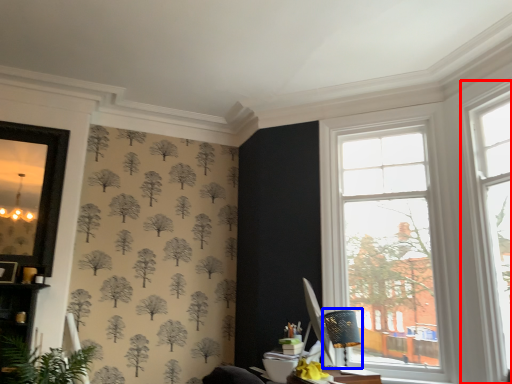
Question: Among these objects, which one is farthest to the camera, window (highlighted by a red box) or table lamp (highlighted by a blue box)?

Choices:
 (A) window
 (B) table lamp

Answer: (B)